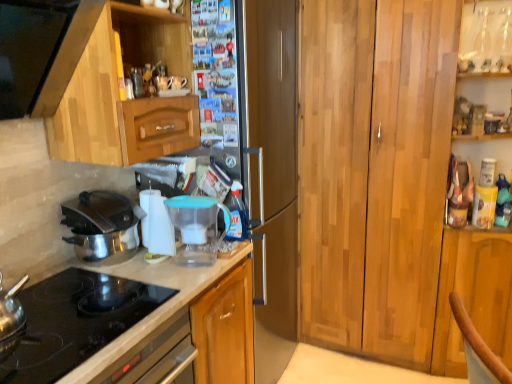
Question: Is polished stainless steel pot at left spatially inside wooden cabinet at right, the 2th cabinetry from the left, or outside of it?

Choices:
 (A) inside
 (B) outside

Answer: (B)

Question: Is polished stainless steel pot at left taller or shorter than wooden cabinet at right, the 2th cabinetry from the left?

Choices:
 (A) tall
 (B) short

Answer: (B)

Question: Which of these objects is positioned closest to the white glossy countertop at lower left?

Choices:
 (A) polished stainless steel pot at left
 (B) transparent plastic water filter pitcher at center, the 1th appliance viewed from the right
 (C) wooden cabinet at right, which ranks as the first cabinetry in right-to-left order
 (D) satin silver refrigerator at center
 (E) transparent plastic bottle at center

Answer: (B)

Question: Which object is positioned closest to the wooden cabinet at right, which ranks as the first cabinetry in right-to-left order?

Choices:
 (A) polished stainless steel pot at left
 (B) white glossy countertop at lower left
 (C) white plastic water filter at center, the first appliance viewed from the left
 (D) transparent plastic water filter pitcher at center, which is counted as the 2th appliance, starting from the left
 (E) satin silver refrigerator at center

Answer: (E)